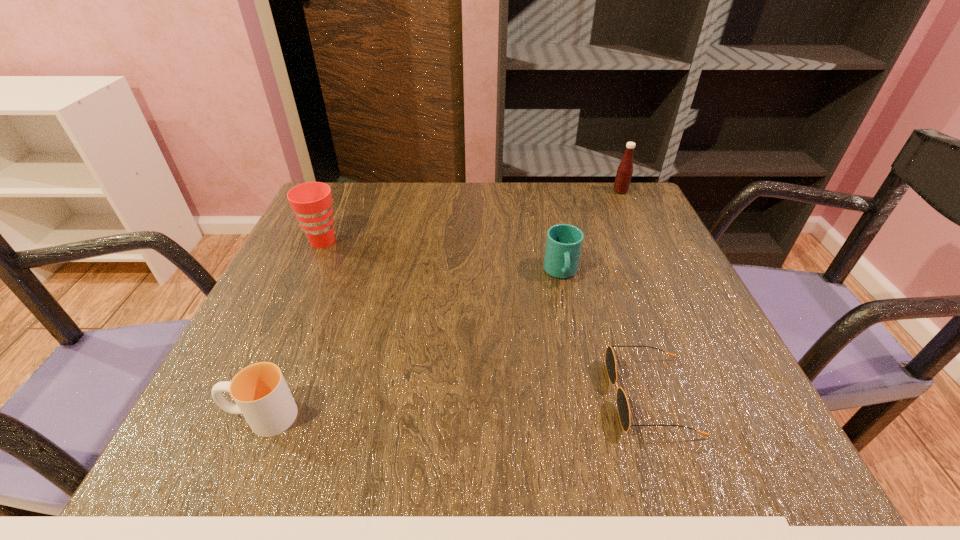
Identify the location of sunglasses at the right edge. The height and width of the screenshot is (540, 960). (623, 408).

You are a GUI agent. You are given a task and a screenshot of the screen. Output one action in this format:
    pyautogui.click(x=<x>, y=<y>)
    Task: Click on the object positioned at the far left corner
    The height and width of the screenshot is (540, 960).
    Given the screenshot: What is the action you would take?
    pyautogui.click(x=311, y=202)

This screenshot has width=960, height=540. I want to click on object located in the near left corner section of the desktop, so click(261, 394).

The width and height of the screenshot is (960, 540). Identify the location of object that is positioned at the far right corner. (624, 172).

The width and height of the screenshot is (960, 540). In order to click on object situated at the near right corner in this screenshot , I will do `click(623, 408)`.

The image size is (960, 540). Identify the location of vacant area at the far edge of the desktop. (564, 214).

This screenshot has height=540, width=960. In the image, there is a desktop. What are the coordinates of `free space at the near edge` in the screenshot? It's located at (646, 431).

Locate an element on the screen. The height and width of the screenshot is (540, 960). vacant position at the left edge of the desktop is located at coordinates click(x=289, y=298).

Where is `vacant area at the right edge of the desktop`? vacant area at the right edge of the desktop is located at coordinates (650, 296).

I want to click on vacant space at the far left corner of the desktop, so click(x=341, y=196).